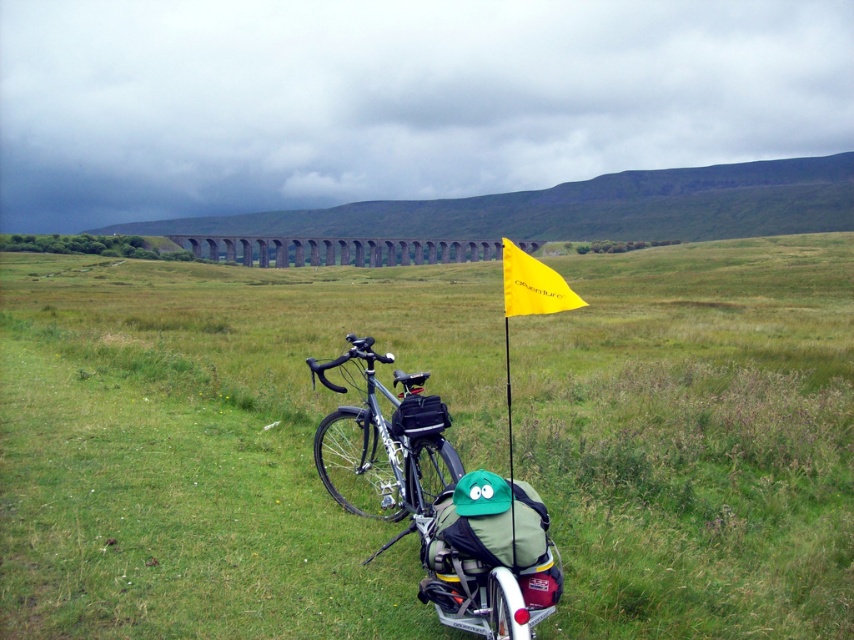
You are a photographer trying to capture the entire green grassy field at center and the yellow fabric flag at center in a single shot. Based on their widths, do you think you can fit both objects in the frame without cropping?

The green grassy field at center might be wider than yellow fabric flag at center, so it is uncertain if both can fit in the frame without cropping. Check the camera angle and adjust accordingly.

From the picture: Based on the scene description, what is the 2D coordinate of the green grassy field at center?

The 2D coordinate of the green grassy field at center is at point (215, 442).

You are a cyclist planning to take a photo of the gray concrete viaduct at center from the shiny metallic bicycle at center. Can you see the viaduct clearly from your current position?

The gray concrete viaduct at center is behind the shiny metallic bicycle at center, so you cannot see the viaduct clearly from your current position on the bicycle because the bicycle is blocking the view.